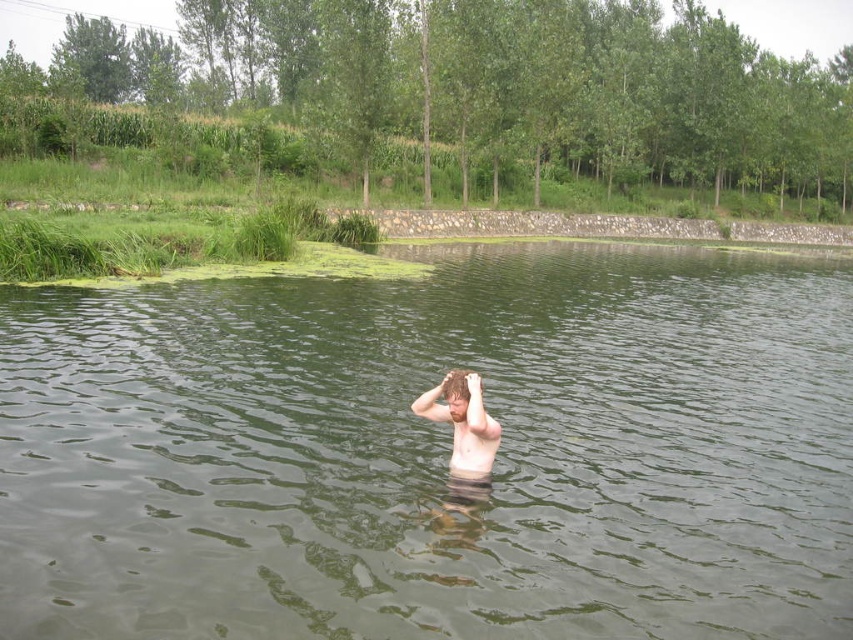
You are a photographer trying to capture the person in the water. Since the skinny white skin at center and brown hair at center are both visible, which one would appear larger in your photo?

The skinny white skin at center would appear larger in the photo because it is bigger than the brown hair at center.

You are a photographer trying to capture the scene of the person in the water. You need to position your camera so that the skinny white skin at center and brown hair at center are both visible. Which object should you focus on first to ensure both are in frame?

You should focus on the brown hair at center first because the skinny white skin at center is to the right of it, so by centering the brown hair at center, the skinny white skin at center will naturally be included to the right in the frame.